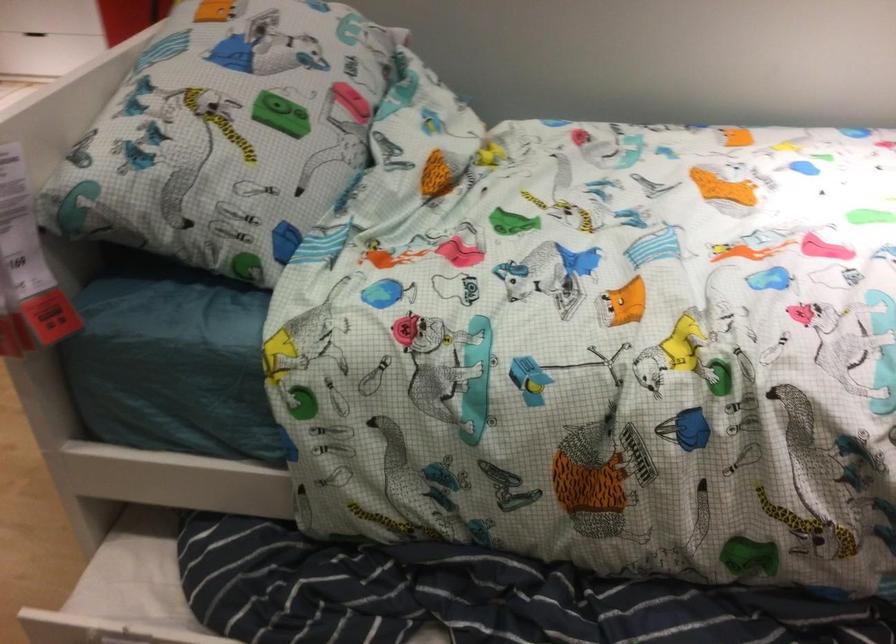
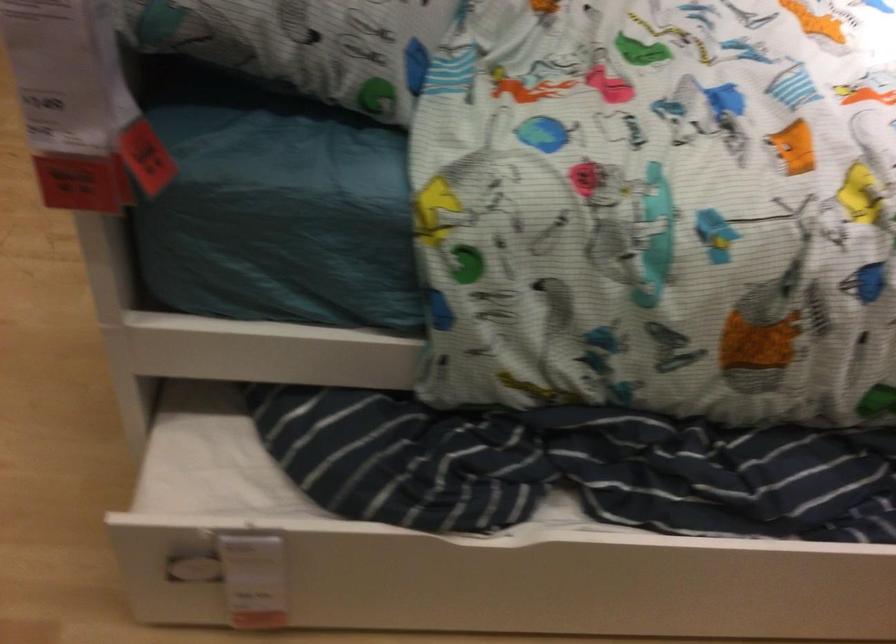
Question: The camera is either moving clockwise (left) or counter-clockwise (right) around the object. The first image is from the beginning of the video and the second image is from the end. Is the camera moving left or right when shooting the video?

Choices:
 (A) Left
 (B) Right

Answer: (A)